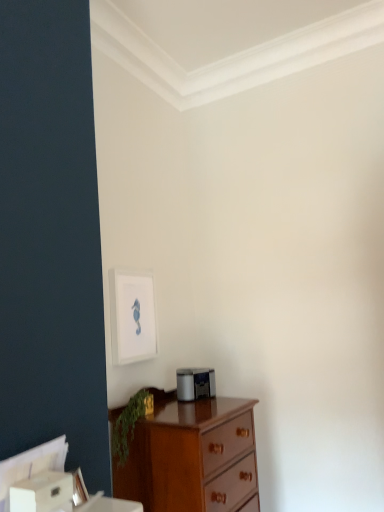
Question: From the image's perspective, would you say wooden chest of drawers at lower left is positioned over white matte picture frame at upper center?

Choices:
 (A) no
 (B) yes

Answer: (A)

Question: Is wooden chest of drawers at lower left aimed at white matte picture frame at upper center?

Choices:
 (A) no
 (B) yes

Answer: (A)

Question: Is wooden chest of drawers at lower left beside white matte picture frame at upper center?

Choices:
 (A) no
 (B) yes

Answer: (A)

Question: Considering the relative sizes of wooden chest of drawers at lower left and white matte picture frame at upper center in the image provided, is wooden chest of drawers at lower left shorter than white matte picture frame at upper center?

Choices:
 (A) yes
 (B) no

Answer: (B)

Question: From a real-world perspective, is wooden chest of drawers at lower left positioned over white matte picture frame at upper center based on gravity?

Choices:
 (A) no
 (B) yes

Answer: (A)

Question: Is wooden chest of drawers at lower left wider than white matte picture frame at upper center?

Choices:
 (A) yes
 (B) no

Answer: (A)

Question: Would you say wooden chest of drawers at lower left is part of green leafy plant at lower left's contents?

Choices:
 (A) no
 (B) yes

Answer: (A)

Question: From a real-world perspective, is green leafy plant at lower left located beneath wooden chest of drawers at lower left?

Choices:
 (A) no
 (B) yes

Answer: (A)

Question: Is green leafy plant at lower left aimed at wooden chest of drawers at lower left?

Choices:
 (A) yes
 (B) no

Answer: (A)

Question: Is green leafy plant at lower left further to camera compared to wooden chest of drawers at lower left?

Choices:
 (A) yes
 (B) no

Answer: (A)

Question: Considering the relative sizes of green leafy plant at lower left and wooden chest of drawers at lower left in the image provided, is green leafy plant at lower left smaller than wooden chest of drawers at lower left?

Choices:
 (A) no
 (B) yes

Answer: (B)

Question: Considering the relative positions of green leafy plant at lower left and wooden chest of drawers at lower left in the image provided, is green leafy plant at lower left to the left of wooden chest of drawers at lower left from the viewer's perspective?

Choices:
 (A) yes
 (B) no

Answer: (A)

Question: Is green leafy plant at lower left inside white matte picture frame at upper center?

Choices:
 (A) no
 (B) yes

Answer: (A)